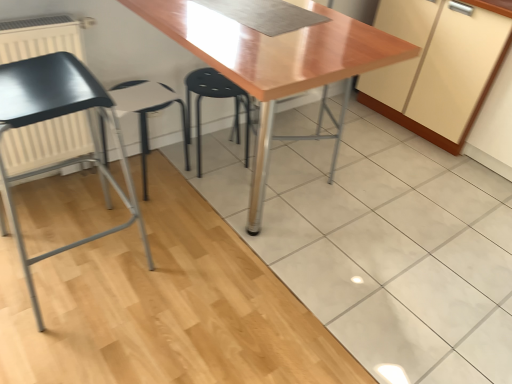
What do you see at coordinates (274, 61) in the screenshot?
I see `glossy wood table at center` at bounding box center [274, 61].

Image resolution: width=512 pixels, height=384 pixels. Identify the location of glossy wood table at center. coord(274,61).

Find the location of `white plastic stool at center`. white plastic stool at center is located at coordinates (146, 117).

Who is more distant, black plastic stool at center or white plastic stool at center?

black plastic stool at center is further from the camera.

Which is in front, point (197, 127) or point (186, 165)?

Positioned in front is point (197, 127).

Is white plastic stool at center completely or partially inside black plastic stool at center?

No, black plastic stool at center does not contain white plastic stool at center.

Does black plastic stool at center touch white plastic stool at center?

No, black plastic stool at center is not beside white plastic stool at center.

Is matte black chair at left beside white matte radiator at left?

matte black chair at left is not next to white matte radiator at left, and they're not touching.

Considering the sizes of objects matte black chair at left and white matte radiator at left in the image provided, who is taller, matte black chair at left or white matte radiator at left?

matte black chair at left is taller.

Based on the photo, from the image's perspective, between matte black chair at left and white matte radiator at left, who is located below?

matte black chair at left, from the image's perspective.

From a real-world perspective, which is physically above, matte black chair at left or white matte radiator at left?

matte black chair at left, from a real-world perspective.

Are glossy wood table at center and matte black chair at left far apart?

glossy wood table at center is actually quite close to matte black chair at left.

Which is more to the left, glossy wood table at center or matte black chair at left?

matte black chair at left.

From the picture: Which object is wider, glossy wood table at center or matte black chair at left?

Wider between the two is glossy wood table at center.

From the image's perspective, is matte black chair at left over glossy wood table at center?

Incorrect, from the image's perspective, matte black chair at left is lower than glossy wood table at center.

Which of these two, matte black chair at left or glossy wood table at center, stands taller?

matte black chair at left is taller.

Where is `chair on the left side of glossy wood table at center`? This screenshot has height=384, width=512. chair on the left side of glossy wood table at center is located at coordinates (58, 118).

Can you confirm if matte black chair at left is positioned to the left of glossy wood table at center?

Yes.

Can you tell me how much matte black chair at left and black plastic stool at center differ in facing direction?

They differ by 90 degrees in their facing directions.

Can you confirm if matte black chair at left is positioned to the left of black plastic stool at center?

Yes.

Based on the photo, is matte black chair at left facing away from black plastic stool at center?

No.

Considering the relative sizes of white plastic stool at center and black plastic stool at center in the image provided, is white plastic stool at center taller than black plastic stool at center?

In fact, white plastic stool at center may be shorter than black plastic stool at center.

Considering the positions of objects white plastic stool at center and black plastic stool at center in the image provided, who is in front, white plastic stool at center or black plastic stool at center?

white plastic stool at center is closer to the camera.

From the image's perspective, which is above, white plastic stool at center or black plastic stool at center?

black plastic stool at center, from the image's perspective.

Is point (125, 97) closer to viewer compared to point (249, 108)?

Yes, it is.

Looking at this image, is white plastic stool at center taller than matte black chair at left?

No.

Could you tell me if white plastic stool at center is facing matte black chair at left?

No.

Would you say white plastic stool at center is inside or outside matte black chair at left?

white plastic stool at center exists outside the volume of matte black chair at left.

Locate an element on the screen. The width and height of the screenshot is (512, 384). folding chair in front of the black plastic stool at center is located at coordinates (146, 117).

Find the location of a particular element. radiator below the matte black chair at left (from a real-world perspective) is located at coordinates (46, 143).

Considering their positions, is matte black chair at left positioned closer to white matte radiator at left than glossy wood table at center?

Among the two, matte black chair at left is located nearer to white matte radiator at left.

When comparing their distances from glossy wood table at center, does white matte radiator at left or black plastic stool at center seem closer?

black plastic stool at center is positioned closer to the anchor glossy wood table at center.

Looking at the image, which one is located closer to white plastic stool at center, white matte radiator at left or matte black chair at left?

The object closer to white plastic stool at center is matte black chair at left.

When comparing their distances from black plastic stool at center, does white matte radiator at left or white plastic stool at center seem closer?

Among the two, white plastic stool at center is located nearer to black plastic stool at center.

From the image, which object appears to be farther from matte black chair at left, black plastic stool at center or white matte radiator at left?

black plastic stool at center is further to matte black chair at left.

Looking at this image, when comparing their distances from white matte radiator at left, does black plastic stool at center or matte black chair at left seem further?

Among the two, black plastic stool at center is located further to white matte radiator at left.

Looking at the image, which one is located further to black plastic stool at center, white matte radiator at left or matte black chair at left?

The object further to black plastic stool at center is white matte radiator at left.

Estimate the real-world distances between objects in this image. Which object is closer to black plastic stool at center, glossy wood table at center or white plastic stool at center?

Among the two, white plastic stool at center is located nearer to black plastic stool at center.

Image resolution: width=512 pixels, height=384 pixels. I want to click on radiator between matte black chair at left and black plastic stool at center along the z-axis, so click(x=46, y=143).

You are a GUI agent. You are given a task and a screenshot of the screen. Output one action in this format:
    pyautogui.click(x=<x>, y=<y>)
    Task: Click on the chair between white matte radiator at left and glossy wood table at center from left to right
    Image resolution: width=512 pixels, height=384 pixels.
    Given the screenshot: What is the action you would take?
    pyautogui.click(x=58, y=118)

Locate an element on the screen. The height and width of the screenshot is (384, 512). radiator between matte black chair at left and white plastic stool at center from front to back is located at coordinates (46, 143).

The image size is (512, 384). I want to click on folding chair located between matte black chair at left and black plastic stool at center in the depth direction, so click(x=146, y=117).